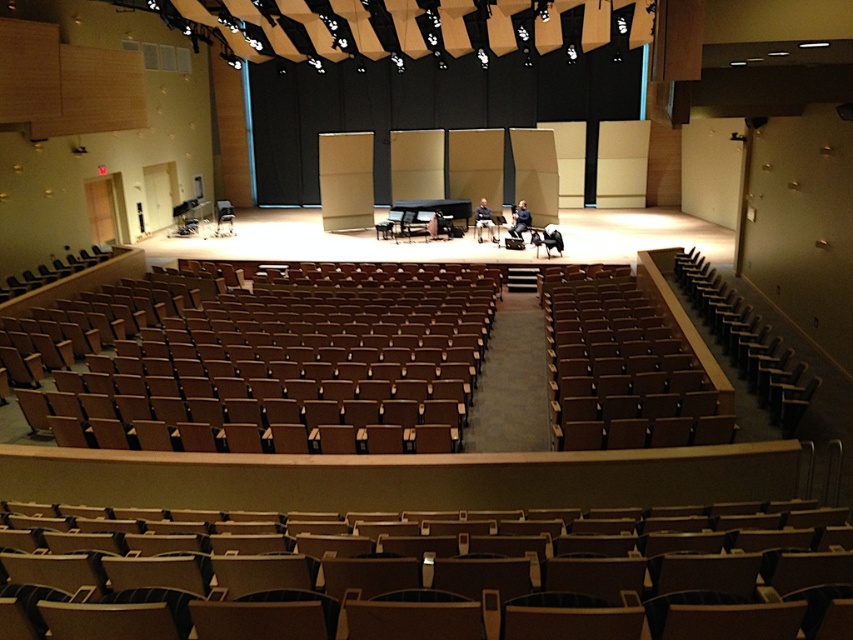
You are sitting in the upper seating area of the auditorium. You want to walk to the stage and pass through the area marked by point (643,616) and point (786,396). Which point should you reach first?

Point (643,616) is in front of point (786,396), so you should reach point (643,616) first.

You are sitting in the brown wood chair at center and want to move to the brown leather chair at right. Which direction should you face to walk towards it?

You should face towards the back of the auditorium because the brown wood chair at center is in front of the brown leather chair at right, meaning the brown leather chair at right is behind you.

You are sitting in the wooden seat at center and want to move to the brown wood chair at center. Which direction should you move to reach it?

The wooden seat at center is positioned on the left side of brown wood chair at center, so you should move to the right to reach it.